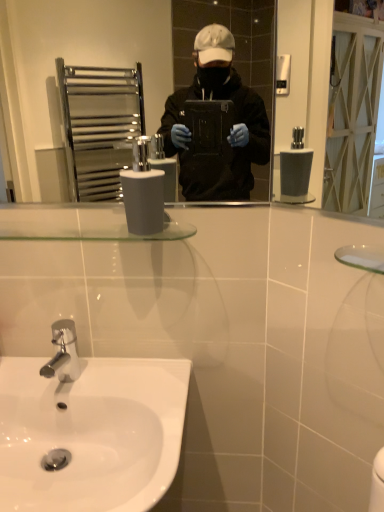
Question: Considering the relative sizes of white matte toilet paper at center and white glossy sink at lower left in the image provided, is white matte toilet paper at center taller than white glossy sink at lower left?

Choices:
 (A) no
 (B) yes

Answer: (A)

Question: Considering the relative sizes of white matte toilet paper at center and white glossy sink at lower left in the image provided, is white matte toilet paper at center smaller than white glossy sink at lower left?

Choices:
 (A) yes
 (B) no

Answer: (A)

Question: Is white matte toilet paper at center oriented towards white glossy sink at lower left?

Choices:
 (A) no
 (B) yes

Answer: (A)

Question: Considering the relative positions of white matte toilet paper at center and white glossy sink at lower left in the image provided, is white matte toilet paper at center in front of white glossy sink at lower left?

Choices:
 (A) yes
 (B) no

Answer: (B)

Question: Can you confirm if white matte toilet paper at center is thinner than white glossy sink at lower left?

Choices:
 (A) yes
 (B) no

Answer: (A)

Question: Is white matte toilet paper at center bigger than white glossy sink at lower left?

Choices:
 (A) yes
 (B) no

Answer: (B)

Question: Is white glossy sink at lower left smaller than white matte toilet paper at center?

Choices:
 (A) no
 (B) yes

Answer: (A)

Question: Considering the relative sizes of white glossy sink at lower left and white matte toilet paper at center in the image provided, is white glossy sink at lower left shorter than white matte toilet paper at center?

Choices:
 (A) yes
 (B) no

Answer: (B)

Question: Is white matte toilet paper at center completely or partially inside white glossy sink at lower left?

Choices:
 (A) no
 (B) yes

Answer: (A)

Question: Is white glossy sink at lower left positioned before white matte toilet paper at center?

Choices:
 (A) yes
 (B) no

Answer: (A)

Question: Does white glossy sink at lower left have a larger size compared to white matte toilet paper at center?

Choices:
 (A) yes
 (B) no

Answer: (A)

Question: Is white glossy sink at lower left located outside white matte toilet paper at center?

Choices:
 (A) yes
 (B) no

Answer: (A)

Question: Is white matte toilet paper at center in front of or behind white glossy sink at lower left in the image?

Choices:
 (A) front
 (B) behind

Answer: (B)